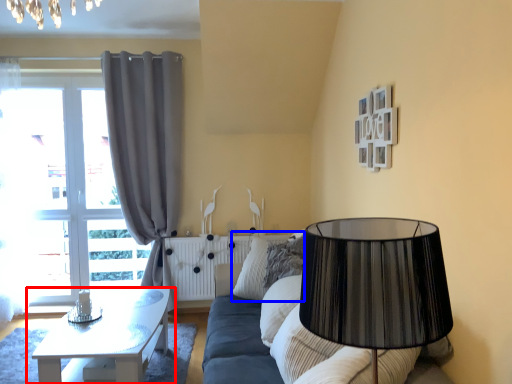
Question: Which object is further to the camera taking this photo, table (highlighted by a red box) or pillow (highlighted by a blue box)?

Choices:
 (A) table
 (B) pillow

Answer: (B)